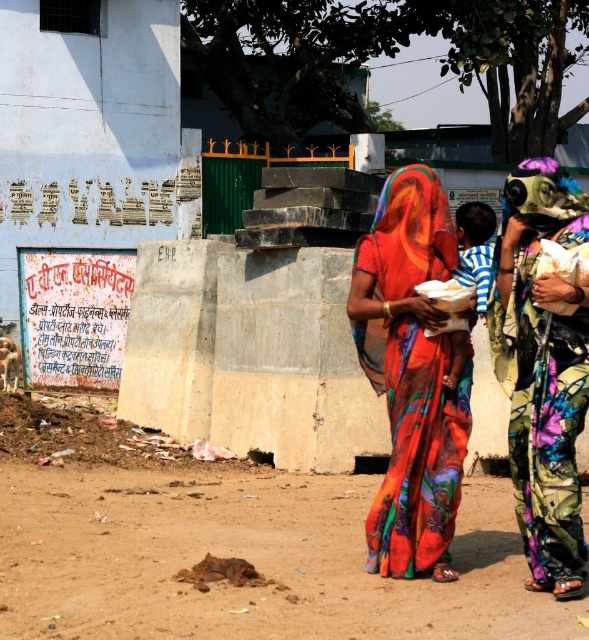
You are a photographer planning to take a photo of the scene. You want to ensure that the brown dirt field at lower left and the multicolored fabric saree at right are both clearly visible. Based on their heights, which object should you focus on first to ensure proper depth of field?

The brown dirt field at lower left has a lesser height compared to the multicolored fabric saree at right, so you should focus on the multicolored fabric saree at right first to ensure proper depth of field.

You are a tailor who needs to determine which item requires more fabric to make between the multicolored fabric saree at right and the striped cotton shirt at center. Based on their sizes, which one would need more fabric?

The multicolored fabric saree at right requires more fabric because its width is larger than the striped cotton shirt at center.